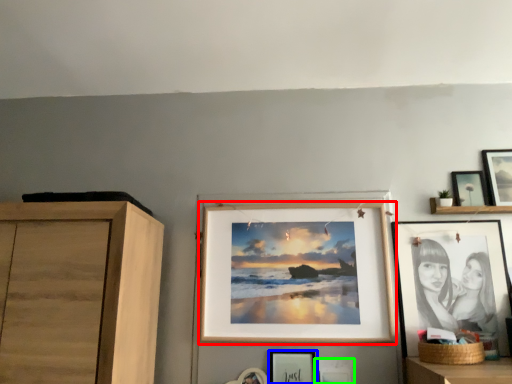
Question: Considering the real-world distances, which object is closest to picture frame (highlighted by a red box)? picture frame (highlighted by a blue box) or picture frame (highlighted by a green box).

Choices:
 (A) picture frame
 (B) picture frame

Answer: (A)